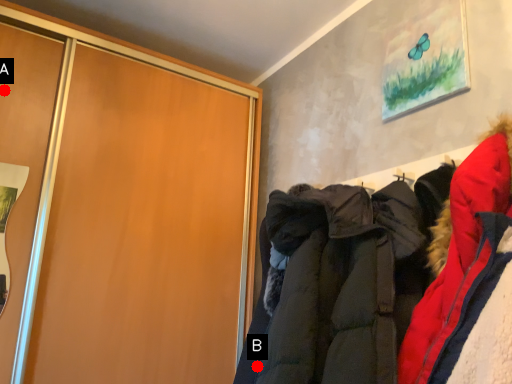
Question: Two points are circled on the image, labeled by A and B beside each circle. Among these points, which one is farthest from the camera?

Choices:
 (A) A is further
 (B) B is further

Answer: (A)